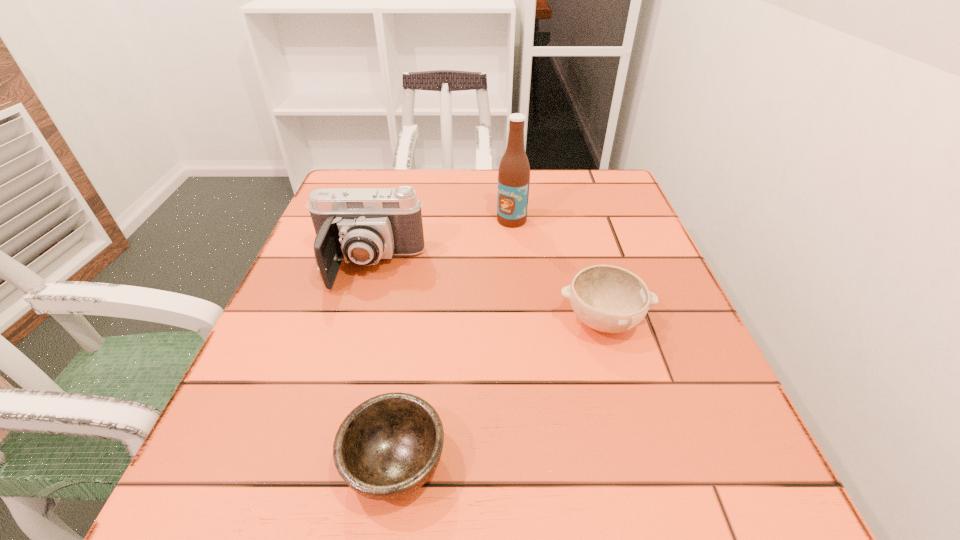
Identify the location of blank space located 0.210m on the back of the taller bowl. click(x=578, y=233).

At what (x,y) coordinates should I click in order to perform the action: click on free point located on the back of the shorter bowl. Please return your answer as a coordinate pair (x, y). The height and width of the screenshot is (540, 960). Looking at the image, I should click on (420, 295).

I want to click on object at the far edge, so click(x=514, y=170).

Where is `object located at the near edge`? object located at the near edge is located at coordinates (386, 448).

At what (x,y) coordinates should I click in order to perform the action: click on object that is positioned at the left edge. Please return your answer as a coordinate pair (x, y). The height and width of the screenshot is (540, 960). Looking at the image, I should click on (360, 225).

You are a GUI agent. You are given a task and a screenshot of the screen. Output one action in this format:
    pyautogui.click(x=<x>, y=<y>)
    Task: Click on the object at the right edge
    The width and height of the screenshot is (960, 540).
    Given the screenshot: What is the action you would take?
    pyautogui.click(x=610, y=299)

Image resolution: width=960 pixels, height=540 pixels. In the image, there is a desktop. In order to click on free region at the far edge in this screenshot , I will do `click(489, 179)`.

The height and width of the screenshot is (540, 960). In the image, there is a desktop. Identify the location of vacant space at the near edge. (645, 503).

This screenshot has height=540, width=960. I want to click on vacant area at the left edge, so click(255, 404).

The image size is (960, 540). In order to click on vacant space at the right edge in this screenshot , I will do `click(636, 258)`.